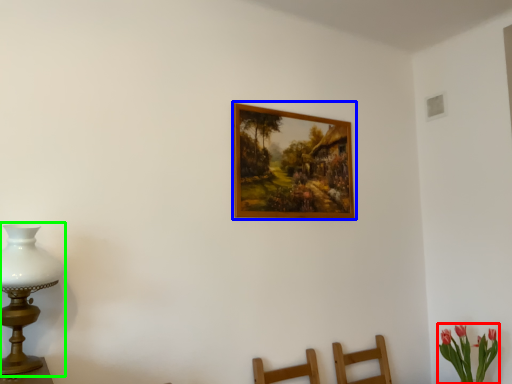
Question: Which is farther away from floral arrangement (highlighted by a red box)? picture frame (highlighted by a blue box) or table lamp (highlighted by a green box)?

Choices:
 (A) picture frame
 (B) table lamp

Answer: (B)